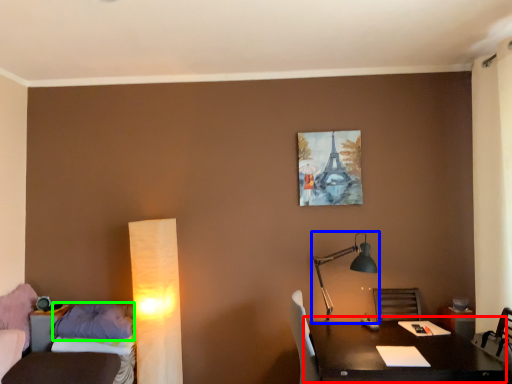
Question: Which is nearer to the table (highlighted by a red box)? lamp (highlighted by a blue box) or pillow (highlighted by a green box).

Choices:
 (A) lamp
 (B) pillow

Answer: (A)